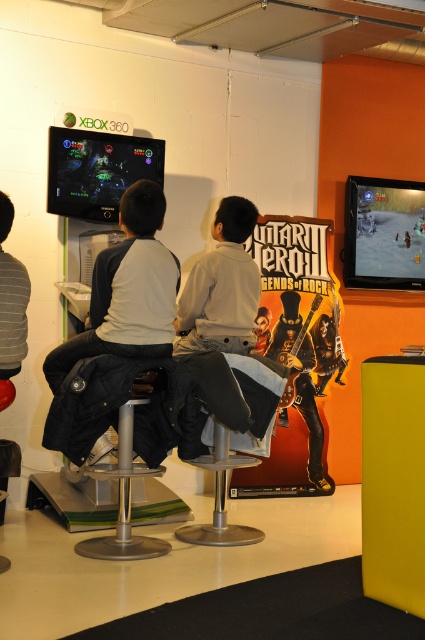
Is point (161, 160) positioned behind point (5, 378)?

Yes, point (161, 160) is behind point (5, 378).

Who is lower down, shiny black monitor at upper left or striped sweater at center?

Positioned lower is striped sweater at center.

Is point (159, 154) less distant than point (3, 220)?

No.

Locate an element on the screen. shiny black monitor at upper left is located at coordinates (98, 170).

Who is shorter, shiny black monitor at upper left or silver metallic bar stool at center?

shiny black monitor at upper left is shorter.

Does shiny black monitor at upper left have a smaller size compared to silver metallic bar stool at center?

Yes.

This screenshot has width=425, height=640. Identify the location of shiny black monitor at upper left. (98, 170).

Can you confirm if dark gray fabric jacket at left is shorter than silver metallic bar stool at center?

No.

Is point (170, 308) closer to viewer compared to point (221, 467)?

Yes, it is.

Find the location of a particular element. dark gray fabric jacket at left is located at coordinates (127, 291).